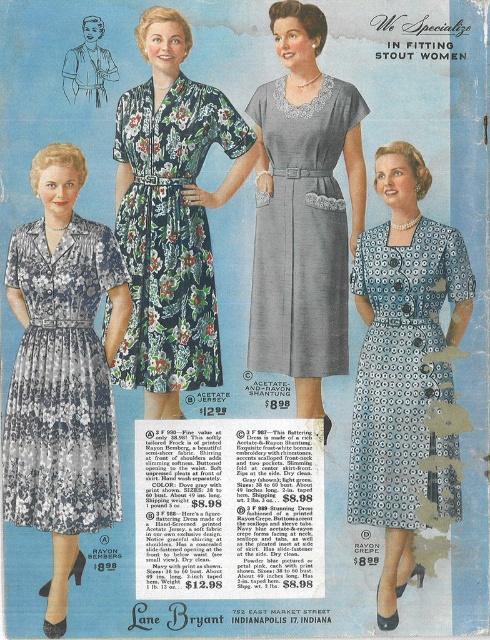
Question: Can you confirm if printed cotton dress at left is positioned to the left of floral print rayon dress at center?

Choices:
 (A) yes
 (B) no

Answer: (A)

Question: From the image, what is the correct spatial relationship of printed cotton dress at left in relation to floral print rayon dress at center?

Choices:
 (A) above
 (B) below

Answer: (B)

Question: Does printed cotton dress at left appear on the right side of blue printed fabric dress at center?

Choices:
 (A) no
 (B) yes

Answer: (A)

Question: Which object is closer to the camera taking this photo?

Choices:
 (A) printed cotton dress at left
 (B) blue printed fabric dress at center

Answer: (A)

Question: Which point is closer to the camera taking this photo?

Choices:
 (A) (135, 214)
 (B) (335, 348)
 (C) (362, 394)
 (D) (75, 224)

Answer: (D)

Question: Which of the following is the closest to the observer?

Choices:
 (A) printed cotton dress at left
 (B) blue printed fabric dress at center
 (C) gray acetate dress at center
 (D) floral print rayon dress at center

Answer: (A)